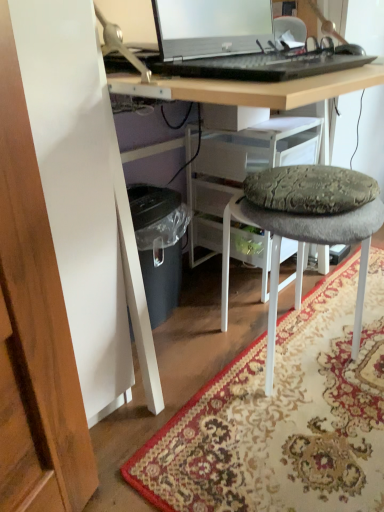
Question: Is textured gray cushioned stool at center next to patterned carpet at lower center?

Choices:
 (A) no
 (B) yes

Answer: (A)

Question: Could patterned carpet at lower center be considered to be inside textured gray cushioned stool at center?

Choices:
 (A) yes
 (B) no

Answer: (B)

Question: Is textured gray cushioned stool at center thinner than patterned carpet at lower center?

Choices:
 (A) no
 (B) yes

Answer: (B)

Question: From a real-world perspective, is textured gray cushioned stool at center physically below patterned carpet at lower center?

Choices:
 (A) no
 (B) yes

Answer: (A)

Question: Is textured gray cushioned stool at center facing away from patterned carpet at lower center?

Choices:
 (A) no
 (B) yes

Answer: (A)

Question: Considering the relative sizes of textured gray cushioned stool at center and patterned carpet at lower center in the image provided, is textured gray cushioned stool at center shorter than patterned carpet at lower center?

Choices:
 (A) no
 (B) yes

Answer: (A)

Question: Are sleek silver laptop at upper center and patterned carpet at lower center beside each other?

Choices:
 (A) yes
 (B) no

Answer: (B)

Question: From a real-world perspective, does sleek silver laptop at upper center sit lower than patterned carpet at lower center?

Choices:
 (A) yes
 (B) no

Answer: (B)

Question: Does sleek silver laptop at upper center have a larger size compared to patterned carpet at lower center?

Choices:
 (A) no
 (B) yes

Answer: (A)

Question: Does sleek silver laptop at upper center lie in front of patterned carpet at lower center?

Choices:
 (A) yes
 (B) no

Answer: (A)

Question: Can you confirm if sleek silver laptop at upper center is shorter than patterned carpet at lower center?

Choices:
 (A) no
 (B) yes

Answer: (A)

Question: Would you consider sleek silver laptop at upper center to be distant from patterned carpet at lower center?

Choices:
 (A) no
 (B) yes

Answer: (A)

Question: Is patterned carpet at lower center smaller than sleek silver laptop at upper center?

Choices:
 (A) no
 (B) yes

Answer: (A)